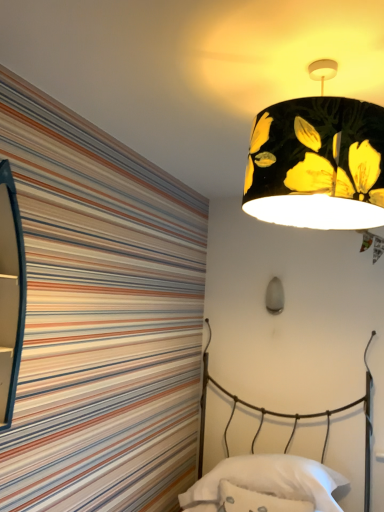
Identify the location of empty space that is ontop of black fabric lampshade at upper right, placed as the second lamp when sorted from back to front (from a real-world perspective). [x=326, y=62].